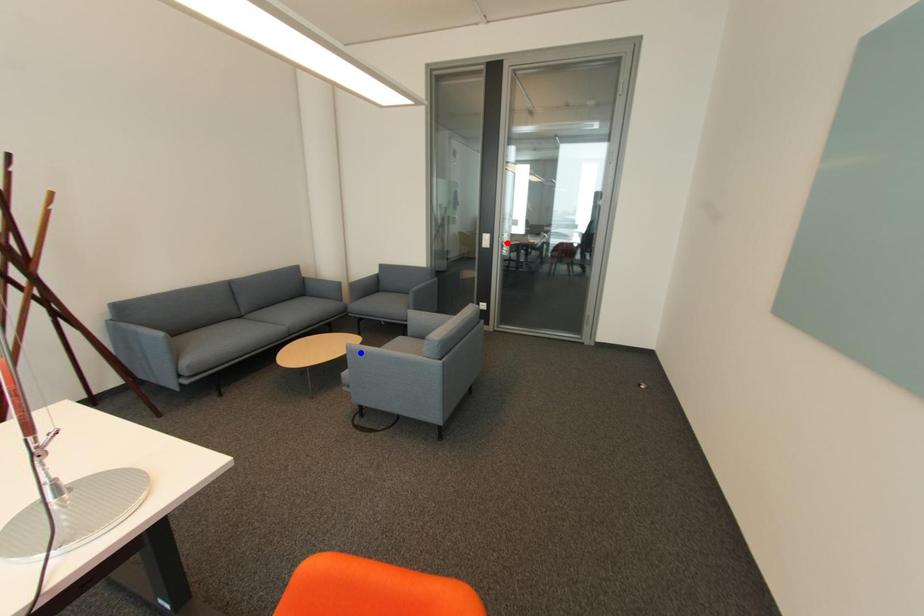
Question: Two points are marked on the image. Which point is closer to the camera?

Choices:
 (A) Blue point is closer.
 (B) Red point is closer.

Answer: (A)